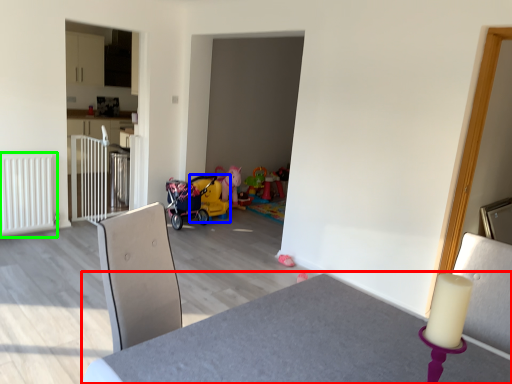
Question: Which object is the closest to the table (highlighted by a red box)? Choose among these: baby carriage (highlighted by a blue box) or radiator (highlighted by a green box).

Choices:
 (A) baby carriage
 (B) radiator

Answer: (B)